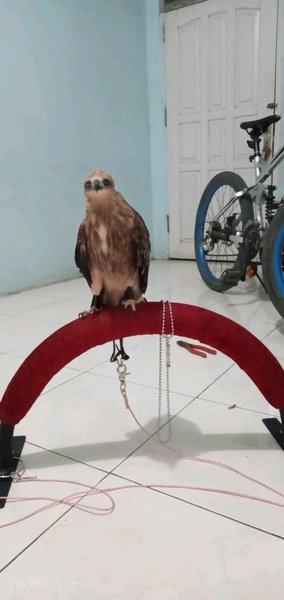
The height and width of the screenshot is (600, 284). I want to click on door hinges, so click(164, 36), click(168, 224), click(166, 119).